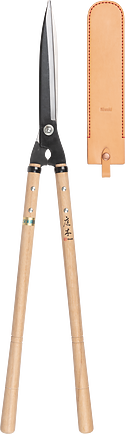
Where is `embroidery on shear holder`? Image resolution: width=125 pixels, height=434 pixels. embroidery on shear holder is located at coordinates coord(122,100).